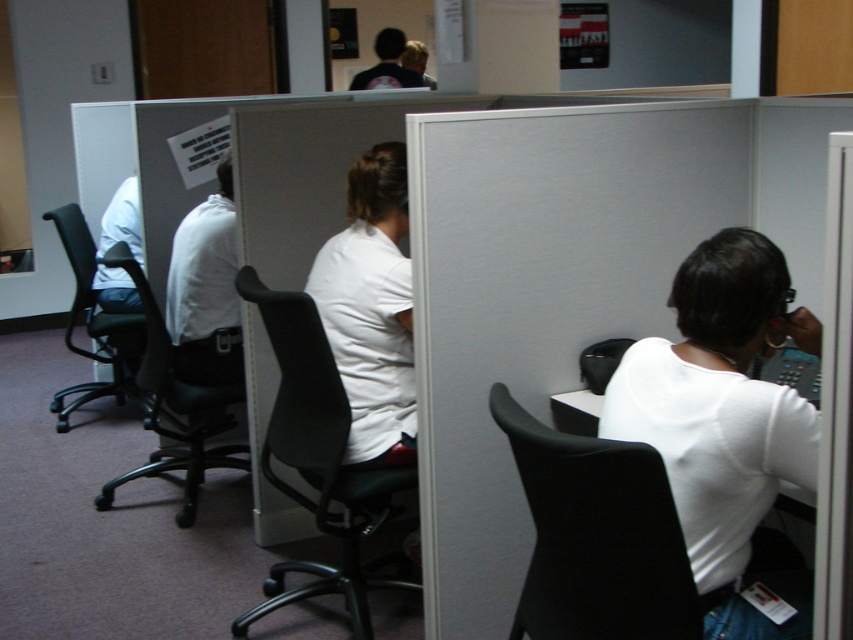
Question: Is white matte shirt at right to the right of black plastic chair at left from the viewer's perspective?

Choices:
 (A) no
 (B) yes

Answer: (B)

Question: Which object is closer to the camera taking this photo?

Choices:
 (A) black leather swivel chair at center
 (B) dark blue shirt at upper center
 (C) black leather swivel chair at left

Answer: (A)

Question: Is black leather swivel chair at center above dark blue shirt at upper center?

Choices:
 (A) yes
 (B) no

Answer: (B)

Question: Which of these objects is positioned farthest from the black plastic chair at left?

Choices:
 (A) white matte shirt at center
 (B) white matte shirt at right
 (C) black leather swivel chair at left
 (D) dark blue shirt at upper center

Answer: (D)

Question: Where is black matte swivel chair at lower right located in relation to dark blue shirt at upper center in the image?

Choices:
 (A) above
 (B) below

Answer: (B)

Question: Which point is closer to the camera taking this photo?

Choices:
 (A) (120, 248)
 (B) (119, 356)

Answer: (A)